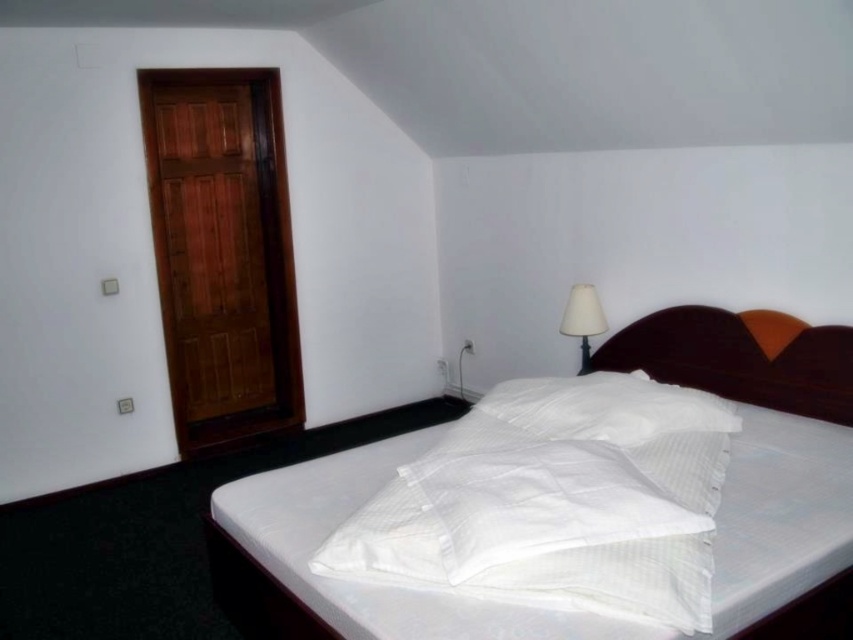
You are trying to place a new rectangular rug in the bedroom. The rug is exactly the same width as the white striped bed at center. Will the rug also fit under the brown fabric headboard at upper right?

The white striped bed at center is thinner than the brown fabric headboard at upper right. Since the rug has the same width as the bed, it will fit under the headboard because the headboard is wider.